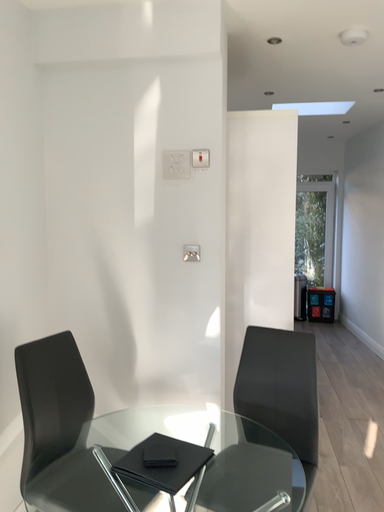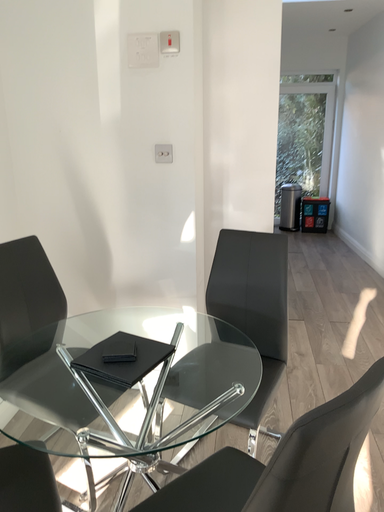
Question: Which way did the camera rotate in the video?

Choices:
 (A) rotated upward
 (B) rotated downward

Answer: (B)